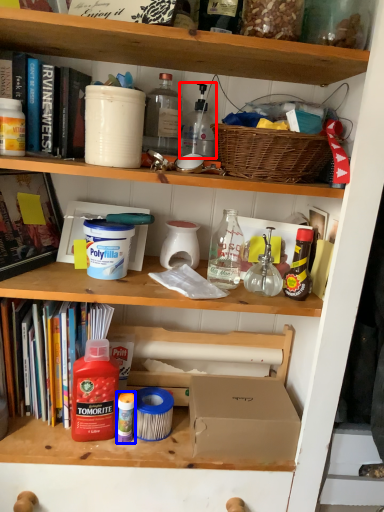
Question: Which object is further to the camera taking this photo, bottle (highlighted by a red box) or bottle (highlighted by a blue box)?

Choices:
 (A) bottle
 (B) bottle

Answer: (A)